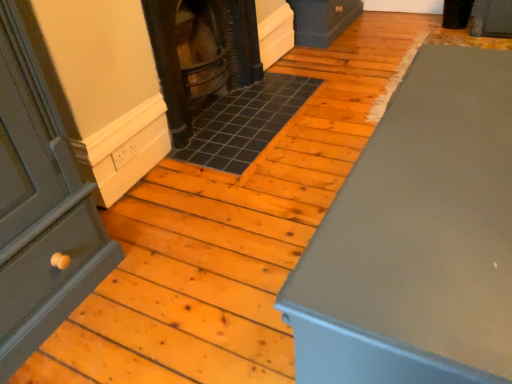
Question: Choose the correct answer: Is dark brown wood stove at center inside matte gray cabinet at right or outside it?

Choices:
 (A) outside
 (B) inside

Answer: (A)

Question: From their relative heights in the image, would you say dark brown wood stove at center is taller or shorter than matte gray cabinet at right?

Choices:
 (A) tall
 (B) short

Answer: (A)

Question: From the image's perspective, is dark brown wood stove at center located above or below matte gray cabinet at right?

Choices:
 (A) above
 (B) below

Answer: (A)

Question: Is matte gray cabinet at right to the left or to the right of dark brown wood stove at center in the image?

Choices:
 (A) right
 (B) left

Answer: (A)

Question: From the image's perspective, relative to dark brown wood stove at center, is matte gray cabinet at right above or below?

Choices:
 (A) above
 (B) below

Answer: (B)

Question: Is matte gray cabinet at right situated inside dark brown wood stove at center or outside?

Choices:
 (A) outside
 (B) inside

Answer: (A)

Question: Relative to dark brown wood stove at center, is matte gray cabinet at right in front or behind?

Choices:
 (A) front
 (B) behind

Answer: (A)